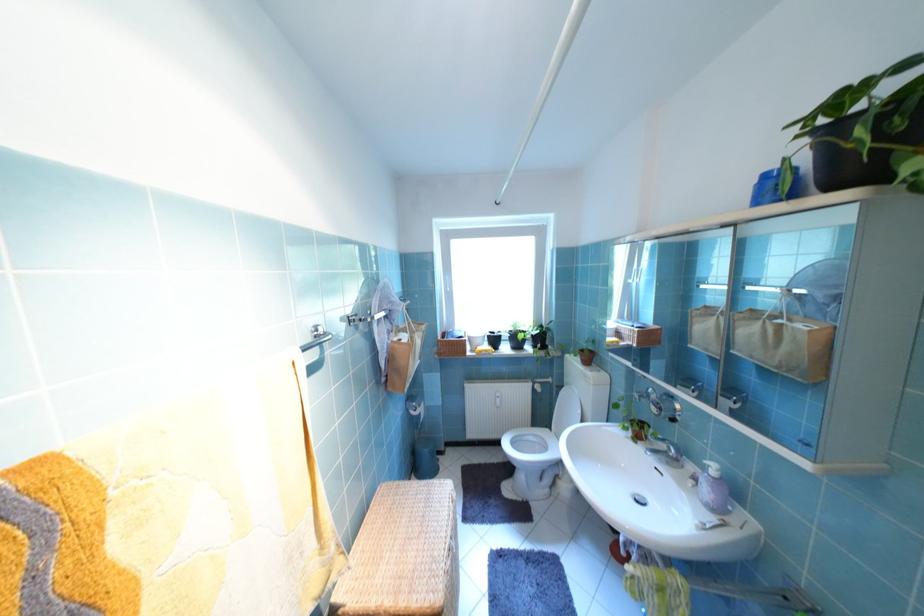
Find where to lift the wicker basket lid. Please return your answer as a coordinate pair (x, y).

(403, 554)